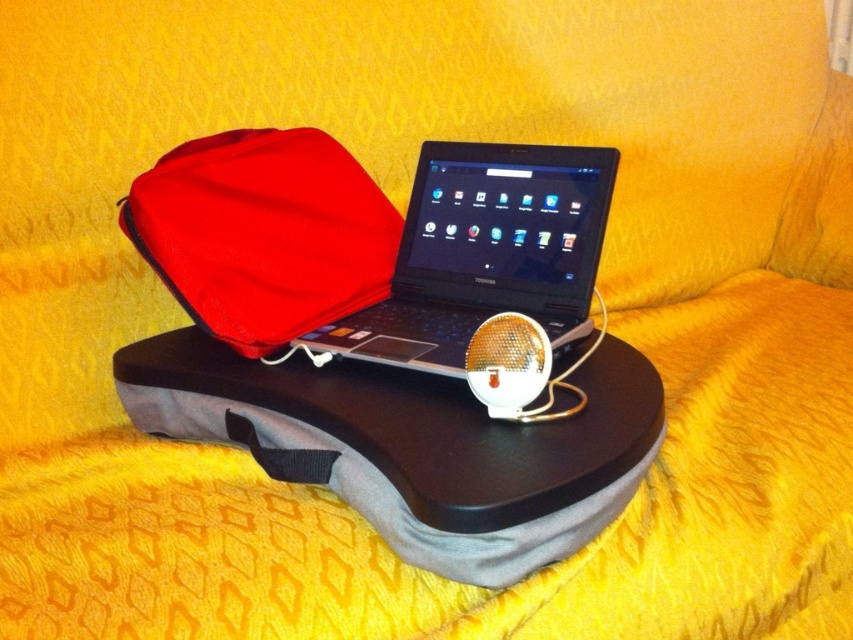
Question: Observing the image, what is the correct spatial positioning of red fabric laptop case at center in reference to black plastic laptop at center?

Choices:
 (A) above
 (B) below

Answer: (A)

Question: Considering the relative positions of red fabric laptop case at center and black plastic laptop at center in the image provided, where is red fabric laptop case at center located with respect to black plastic laptop at center?

Choices:
 (A) right
 (B) left

Answer: (B)

Question: Does red fabric laptop case at center appear on the left side of black plastic laptop at center?

Choices:
 (A) yes
 (B) no

Answer: (A)

Question: Which point appears farthest from the camera in this image?

Choices:
 (A) (213, 138)
 (B) (543, 236)

Answer: (A)

Question: Which point appears closest to the camera in this image?

Choices:
 (A) (352, 332)
 (B) (372, 269)

Answer: (A)